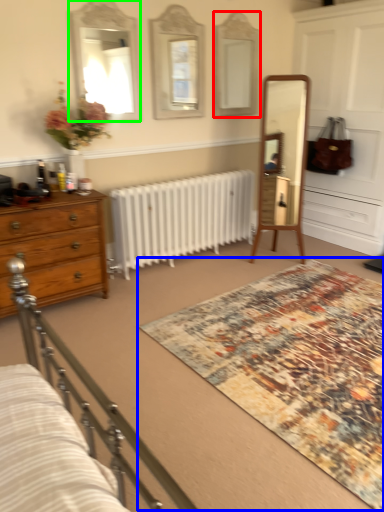
Question: Which is farther away from mirror (highlighted by a red box)? mat (highlighted by a blue box) or mirror (highlighted by a green box)?

Choices:
 (A) mat
 (B) mirror

Answer: (A)